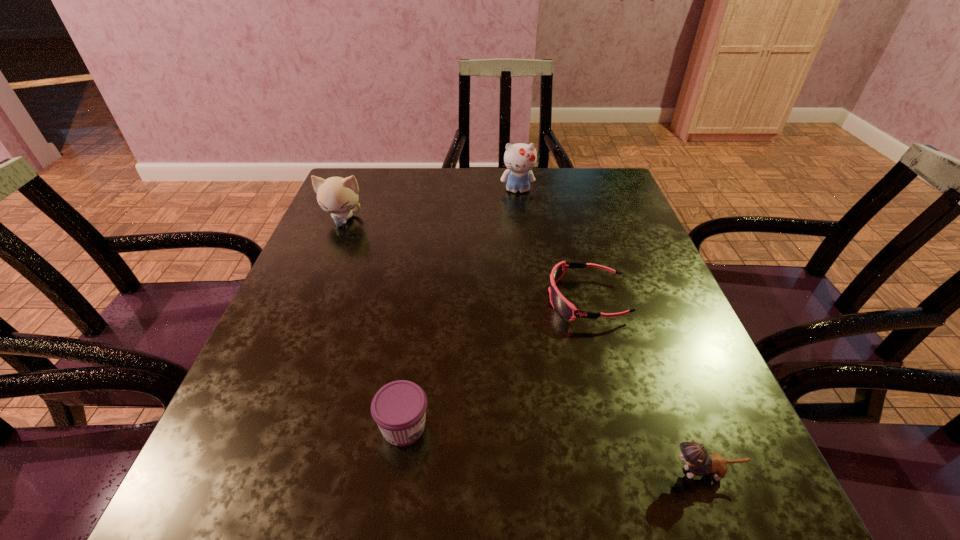
Where is `free area in between the shortest object and the leftmost kitten`? The height and width of the screenshot is (540, 960). free area in between the shortest object and the leftmost kitten is located at coordinates (465, 259).

You are a GUI agent. You are given a task and a screenshot of the screen. Output one action in this format:
    pyautogui.click(x=<x>, y=<y>)
    Task: Click on the second closest object to the rightmost kitten
    The width and height of the screenshot is (960, 540).
    Given the screenshot: What is the action you would take?
    coord(399,408)

Identify which object is located as the nearest to the rightmost kitten. Please provide its 2D coordinates. Your answer should be formatted as a tuple, i.e. [(x, y)], where the tuple contains the x and y coordinates of a point satisfying the conditions above.

[(562, 306)]

Locate which kitten ranks in proximity to the leftmost kitten. Please provide its 2D coordinates. Your answer should be formatted as a tuple, i.e. [(x, y)], where the tuple contains the x and y coordinates of a point satisfying the conditions above.

[(520, 158)]

Identify which kitten is located as the second nearest to the farthest kitten. Please provide its 2D coordinates. Your answer should be formatted as a tuple, i.e. [(x, y)], where the tuple contains the x and y coordinates of a point satisfying the conditions above.

[(699, 463)]

Find the location of `free spot that satisfies the following two spatial constraints: 1. on the front-facing side of the second kitten from left to right; 2. on the front label of the fourth farthest object`. free spot that satisfies the following two spatial constraints: 1. on the front-facing side of the second kitten from left to right; 2. on the front label of the fourth farthest object is located at coordinates (547, 427).

You are a GUI agent. You are given a task and a screenshot of the screen. Output one action in this format:
    pyautogui.click(x=<x>, y=<y>)
    Task: Click on the blank space that satisfies the following two spatial constraints: 1. on the front-facing side of the second kitten from left to right; 2. on the front label of the jam
    This screenshot has height=540, width=960.
    Given the screenshot: What is the action you would take?
    pyautogui.click(x=547, y=427)

Find the location of a particular element. vacant region that satisfies the following two spatial constraints: 1. on the front-facing side of the farthest object; 2. on the front label of the fourth object from right to left is located at coordinates (547, 427).

You are a GUI agent. You are given a task and a screenshot of the screen. Output one action in this format:
    pyautogui.click(x=<x>, y=<y>)
    Task: Click on the blank space that satisfies the following two spatial constraints: 1. on the front-facing side of the second kitten from right to left; 2. on the front label of the fourth object from right to left
    This screenshot has width=960, height=540.
    Given the screenshot: What is the action you would take?
    pyautogui.click(x=547, y=427)